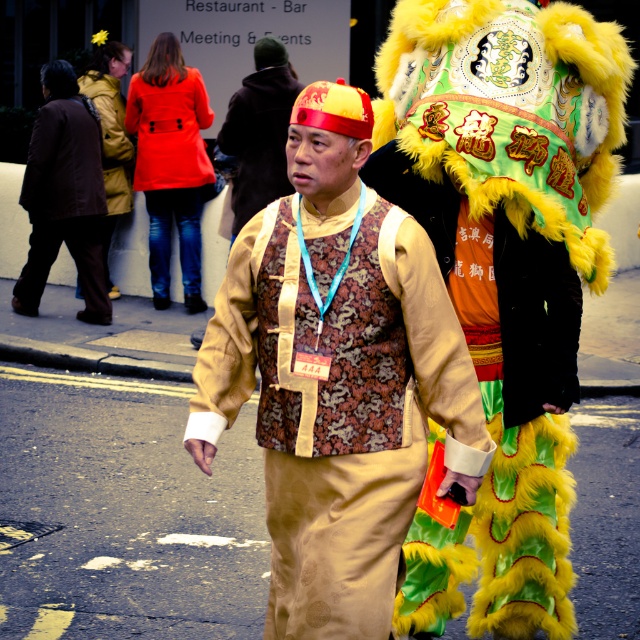
You are a photographer trying to capture both the brown fabric jacket at left and the gold brocade vest at center in a single shot. Based on their heights, which one should you adjust your camera angle to focus on first to ensure both are in frame?

The brown fabric jacket at left is taller than the gold brocade vest at center, so you should focus on the brown fabric jacket at left first to ensure the entire height of both objects fits within the frame.

You are an event planner arranging a photo shoot for the cultural event. You need to position the matte brown vest at center and the yellow furry headdress at upper right in a way that maintains their original spatial relationship. Which object should be placed to the left of the other?

The matte brown vest at center should be placed to the left of the yellow furry headdress at upper right since the matte brown vest at center is positioned on the left side of yellow furry headdress at upper right in the original scene.